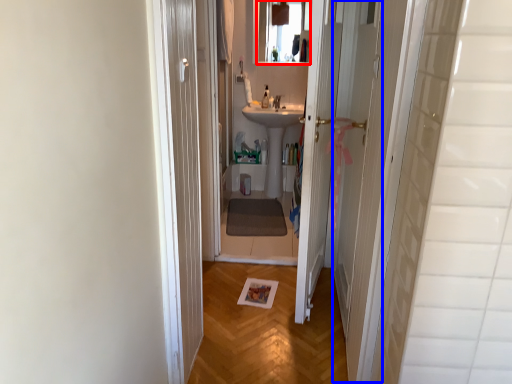
Question: Which of the following is the closest to the observer, mirror (highlighted by a red box) or screen door (highlighted by a blue box)?

Choices:
 (A) mirror
 (B) screen door

Answer: (B)